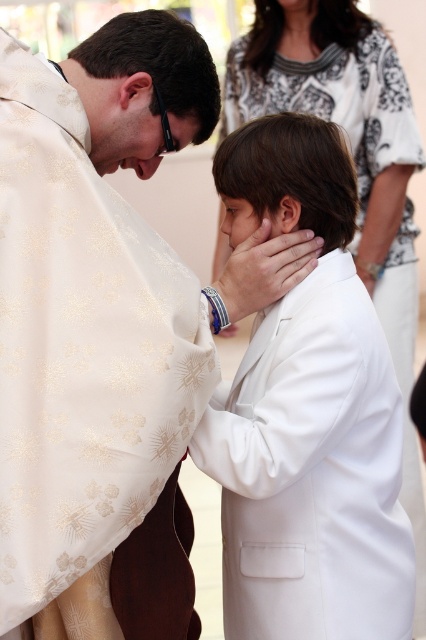
Consider the image. You are a photographer standing in front of the scene. You need to capture a photo where both the white textured robe at left and the brown matte skin at center are clearly visible. Considering their sizes, which object should you focus on to ensure both are in frame without cropping?

The white textured robe at left is bigger than brown matte skin at center, so focusing on the white textured robe at left will ensure both are in frame without cropping since it occupies more space.

You are an artist observing a religious ceremony scene. In the image, you notice two central figures with the matte gold face at center and the brown matte skin at center. Based on their sizes, which figure is positioned higher up in the composition?

The matte gold face at center is taller than the brown matte skin at center, so the matte gold face at center is positioned higher up in the composition.

In the scene described, there is a point at coordinates (124, 134). Based on the image, what object is located at this point?

The point at coordinates (124, 134) indicates the matte gold face at center.